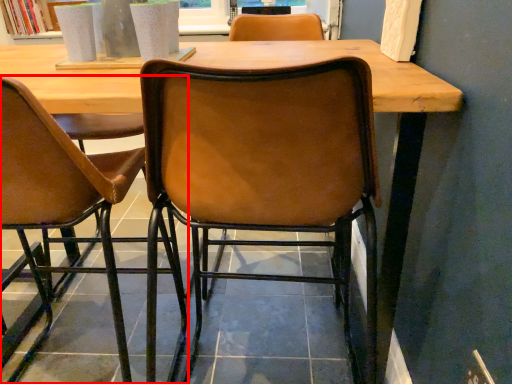
Question: From the image's perspective, considering the relative positions of chair (annotated by the red box) and chair in the image provided, where is chair (annotated by the red box) located with respect to the staircase?

Choices:
 (A) below
 (B) above

Answer: (B)